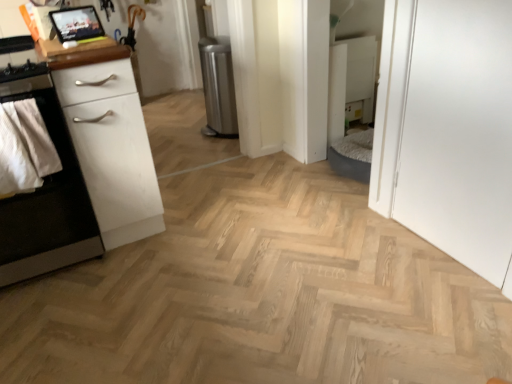
Question: Is white matte cabinet at left in front of matte wood tablet at upper left?

Choices:
 (A) yes
 (B) no

Answer: (A)

Question: Would you say white matte cabinet at left is outside matte wood tablet at upper left?

Choices:
 (A) yes
 (B) no

Answer: (A)

Question: Is white matte cabinet at left further to the viewer compared to matte wood tablet at upper left?

Choices:
 (A) yes
 (B) no

Answer: (B)

Question: Considering the relative positions of white matte cabinet at left and matte wood tablet at upper left in the image provided, is white matte cabinet at left to the right of matte wood tablet at upper left from the viewer's perspective?

Choices:
 (A) no
 (B) yes

Answer: (A)

Question: Is there a large distance between white matte cabinet at left and matte wood tablet at upper left?

Choices:
 (A) yes
 (B) no

Answer: (B)

Question: From the image's perspective, is white matte cabinet at left under matte wood tablet at upper left?

Choices:
 (A) yes
 (B) no

Answer: (A)

Question: Can white matte chest of drawers at left be found inside natural wood floor at center?

Choices:
 (A) no
 (B) yes

Answer: (A)

Question: Considering the relative sizes of natural wood floor at center and white matte chest of drawers at left in the image provided, is natural wood floor at center thinner than white matte chest of drawers at left?

Choices:
 (A) no
 (B) yes

Answer: (A)

Question: Is natural wood floor at center not close to white matte chest of drawers at left?

Choices:
 (A) yes
 (B) no

Answer: (B)

Question: Is natural wood floor at center smaller than white matte chest of drawers at left?

Choices:
 (A) no
 (B) yes

Answer: (A)

Question: Can you confirm if natural wood floor at center is positioned to the right of white matte chest of drawers at left?

Choices:
 (A) yes
 (B) no

Answer: (A)

Question: Considering the relative sizes of natural wood floor at center and white matte chest of drawers at left in the image provided, is natural wood floor at center shorter than white matte chest of drawers at left?

Choices:
 (A) no
 (B) yes

Answer: (B)

Question: Is matte wood tablet at upper left smaller than white matte cabinet at left?

Choices:
 (A) no
 (B) yes

Answer: (B)